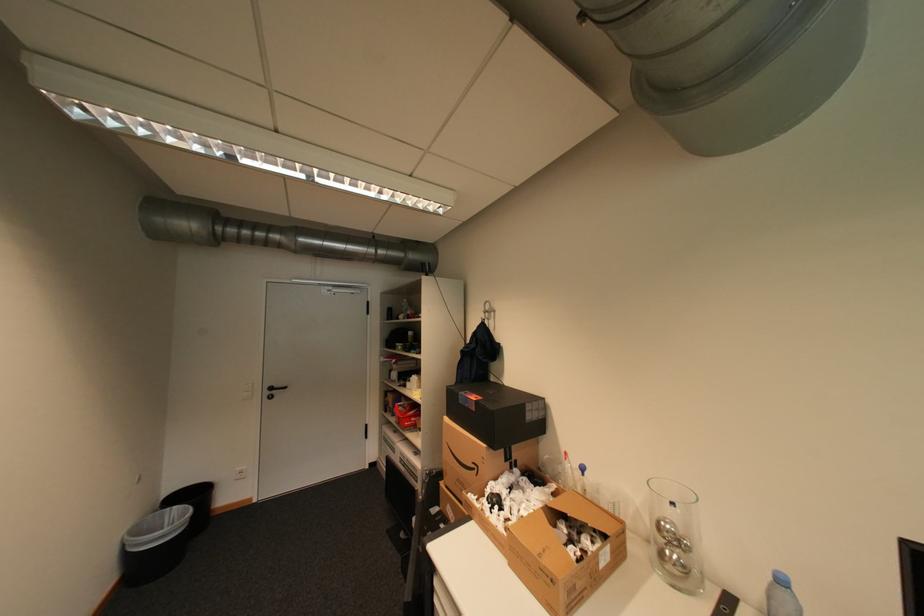
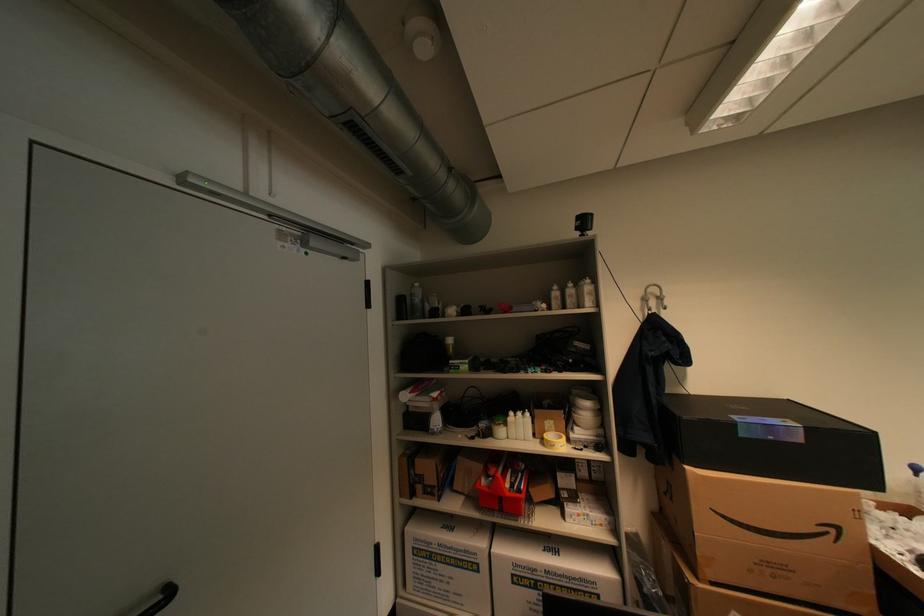
Locate, in the second image, the point that corresponds to [395,442] in the first image.

(439, 556)